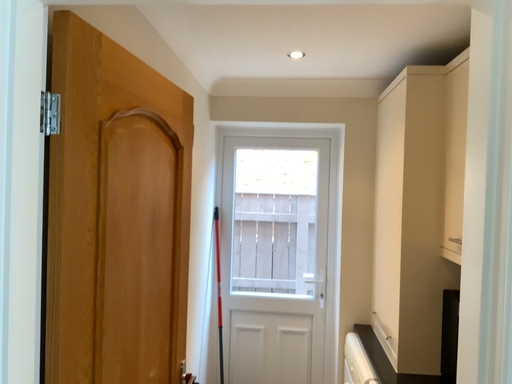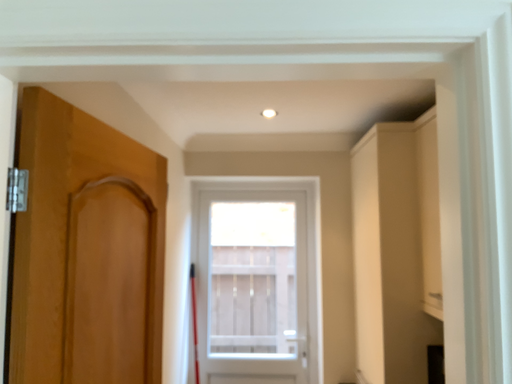
Question: Which way did the camera rotate in the video?

Choices:
 (A) rotated upward
 (B) rotated downward

Answer: (A)